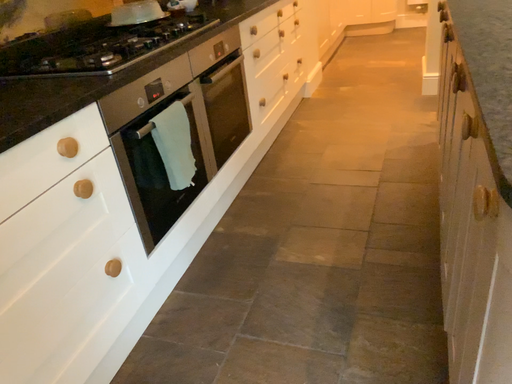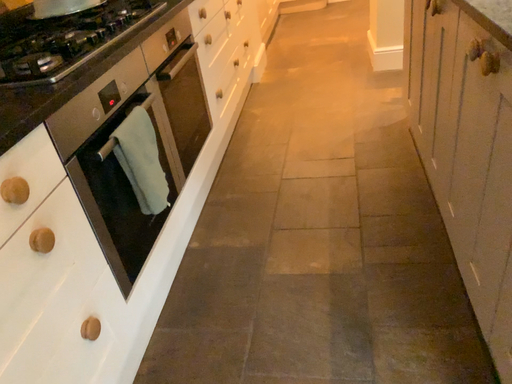
Question: How did the camera likely rotate when shooting the video?

Choices:
 (A) rotated left
 (B) rotated right

Answer: (B)